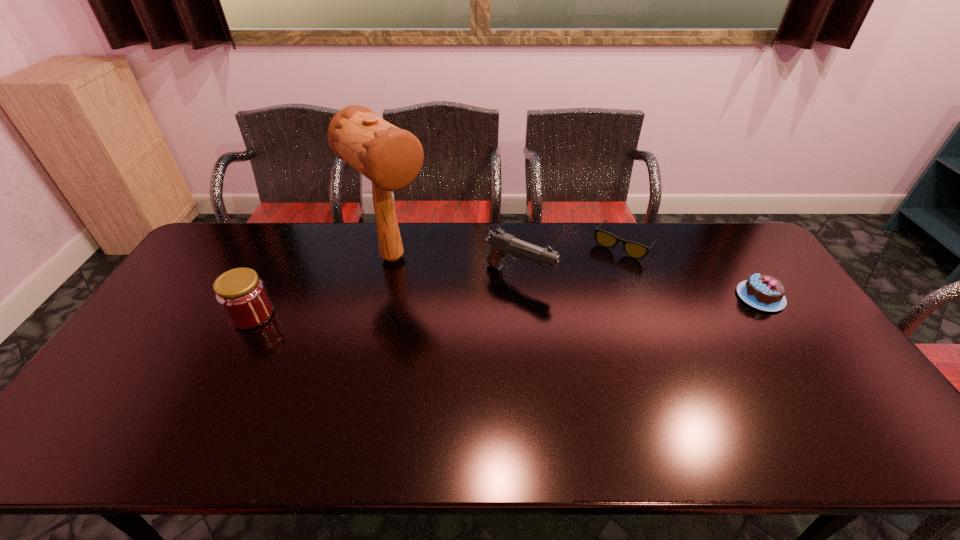
This screenshot has height=540, width=960. Identify the location of sunglasses at the far edge. (634, 250).

What are the coordinates of `object present at the right edge` in the screenshot? It's located at (761, 291).

The width and height of the screenshot is (960, 540). I want to click on free space at the far edge of the desktop, so click(325, 223).

Find the location of a particular element. blank space at the near edge of the desktop is located at coordinates (634, 408).

In the image, there is a desktop. At what (x,y) coordinates should I click in order to perform the action: click on free space at the left edge. Please return your answer as a coordinate pair (x, y). This screenshot has width=960, height=540. Looking at the image, I should click on (171, 330).

Image resolution: width=960 pixels, height=540 pixels. In the image, there is a desktop. Find the location of `vacant area at the right edge`. vacant area at the right edge is located at coordinates (772, 325).

The width and height of the screenshot is (960, 540). Identify the location of free space at the far left corner. (223, 258).

This screenshot has height=540, width=960. What are the coordinates of `vacant space at the far right corner` in the screenshot? It's located at (708, 225).

Identify the location of vacant area between the jam and the rightmost object. The height and width of the screenshot is (540, 960). (506, 306).

This screenshot has width=960, height=540. I want to click on unoccupied position between the fourth object from left to right and the rightmost object, so click(692, 271).